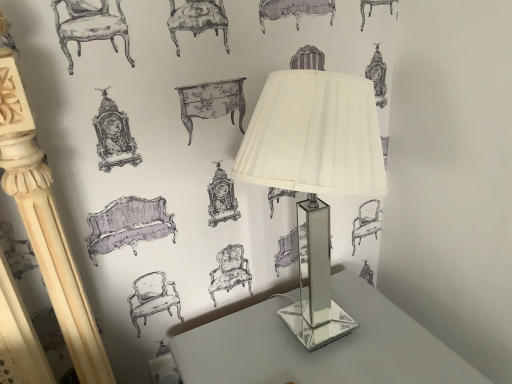
In order to click on vacant region to the right of clear glass lamp at center in this screenshot , I will do `click(404, 336)`.